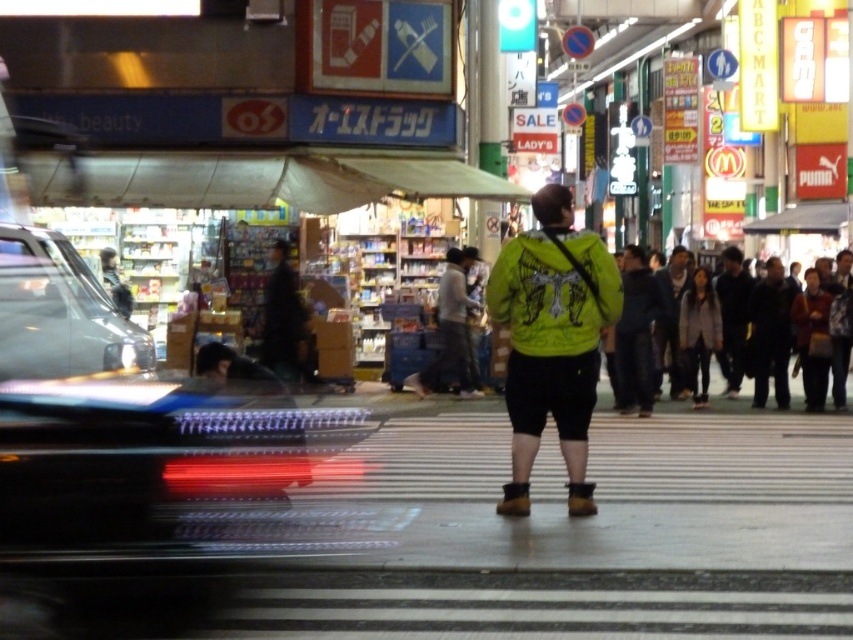
You are a delivery person who needs to cross the street to deliver a package to the address at the dark blue jeans at center. The shiny black car at left is blocking your path. Can you safely walk around the car to reach your destination?

The shiny black car at left and dark blue jeans at center are 33.60 feet apart. Since the car is blocking the path, you can safely walk around it as there is sufficient distance between them to maneuver around the car and reach the dark blue jeans at center.

Looking at this image, you are a pedestrian standing at the crosswalk and see the neon green jacket at center and dark blue jeans at center. Which clothing item is closer to the left side of the crosswalk?

The neon green jacket at center is closer to the left side of the crosswalk because it is positioned to the left of the dark blue jeans at center.